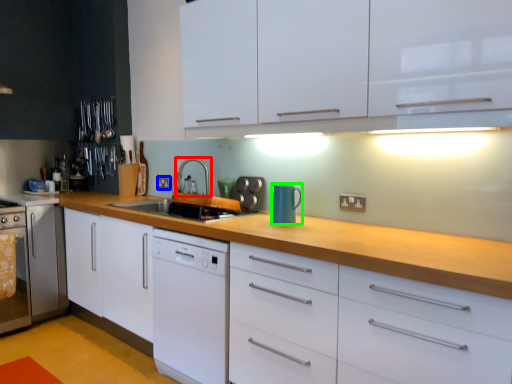
Question: Which object is positioned closest to tap (highlighted by a red box)? Select from electric outlet (highlighted by a blue box) and kitchen appliance (highlighted by a green box).

Choices:
 (A) electric outlet
 (B) kitchen appliance

Answer: (A)